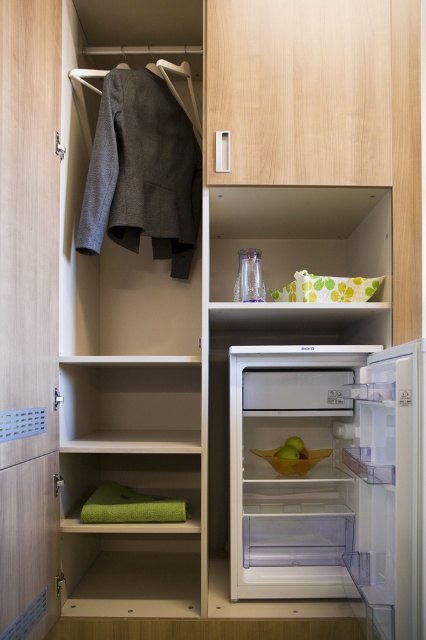
Question: Which point is closer to the camera?

Choices:
 (A) beige wood shelf at lower left
 (B) transparent plastic drawer at lower center
 (C) green fabric towel at lower left
 (D) green matte apple at center

Answer: (A)

Question: Is beige wood shelf at lower left thinner than transparent plastic drawer at lower center?

Choices:
 (A) no
 (B) yes

Answer: (A)

Question: Which object is farther from the camera taking this photo?

Choices:
 (A) transparent plastic drawer at lower center
 (B) beige wood shelf at lower left

Answer: (A)

Question: Does green fabric towel at lower left appear on the right side of green matte apple at center?

Choices:
 (A) no
 (B) yes

Answer: (A)

Question: Does wooden door at left appear under green fabric towel at lower left?

Choices:
 (A) no
 (B) yes

Answer: (A)

Question: Which point appears farthest from the camera in this image?

Choices:
 (A) (305, 564)
 (B) (192, 369)

Answer: (B)